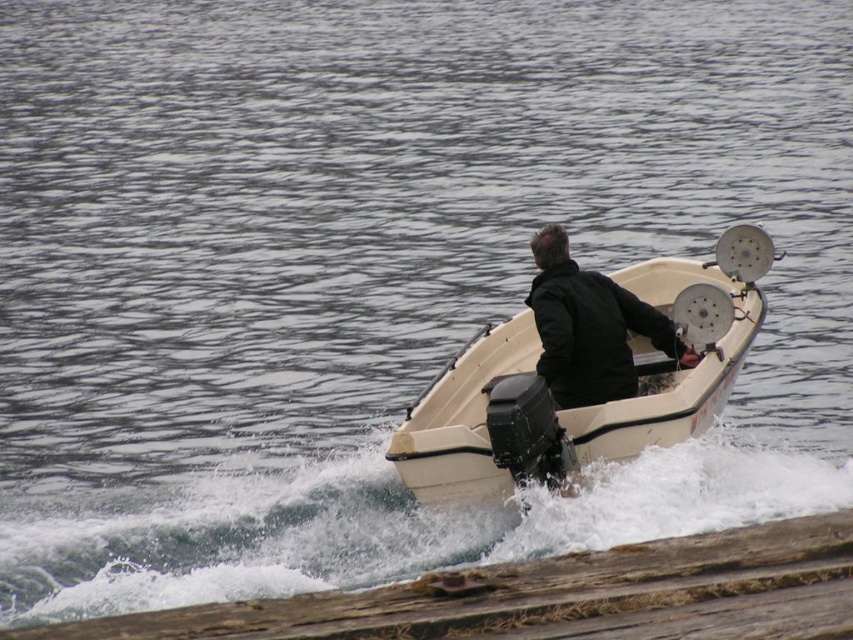
Question: Which object is positioned closest to the black matte jacket at center?

Choices:
 (A) wooden log at lower center
 (B) white plastic boat at center

Answer: (B)

Question: Which point is farther to the camera?

Choices:
 (A) wooden log at lower center
 (B) black matte jacket at center

Answer: (B)

Question: Can you confirm if white plastic boat at center is positioned below wooden log at lower center?

Choices:
 (A) no
 (B) yes

Answer: (A)

Question: Is white plastic boat at center above wooden log at lower center?

Choices:
 (A) no
 (B) yes

Answer: (B)

Question: Considering the relative positions of wooden log at lower center and black matte jacket at center in the image provided, where is wooden log at lower center located with respect to black matte jacket at center?

Choices:
 (A) left
 (B) right

Answer: (A)

Question: Which object is the farthest from the white plastic boat at center?

Choices:
 (A) wooden log at lower center
 (B) black matte jacket at center

Answer: (A)